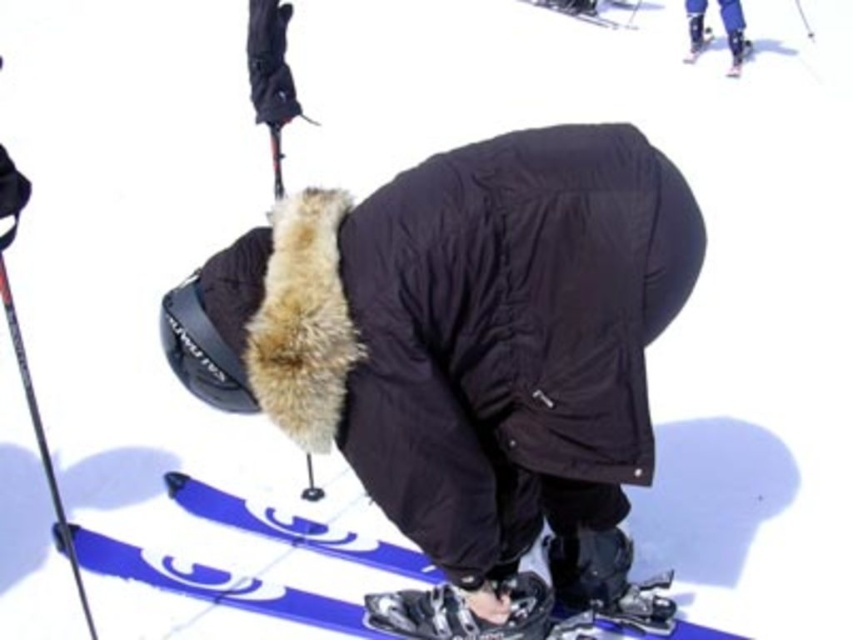
Is blue glossy ski at upper right in front of blue glossy ski at upper center?

That is True.

Does blue glossy ski at upper right have a lesser width compared to blue glossy ski at upper center?

Yes, blue glossy ski at upper right is thinner than blue glossy ski at upper center.

Does point (695, 54) come in front of point (570, 10)?

Yes, it is in front of point (570, 10).

Locate an element on the screen. The image size is (853, 640). blue glossy ski at upper right is located at coordinates (737, 51).

Which of these two, black matte jacket at center or blue glossy ski at upper right, stands shorter?

Standing shorter between the two is blue glossy ski at upper right.

Does black matte jacket at center have a smaller size compared to blue glossy ski at upper right?

No.

Which is in front, point (393, 189) or point (688, 60)?

Point (393, 189)

Find the location of a particular element. black matte jacket at center is located at coordinates (465, 356).

Can you confirm if black matte jacket at center is positioned below blue glossy ski at upper center?

Yes.

Between black matte jacket at center and blue glossy ski at upper center, which one appears on the right side from the viewer's perspective?

Positioned to the right is blue glossy ski at upper center.

Does point (386, 449) come in front of point (593, 20)?

Yes, it is in front of point (593, 20).

Find the location of `black matte jacket at center`. black matte jacket at center is located at coordinates (465, 356).